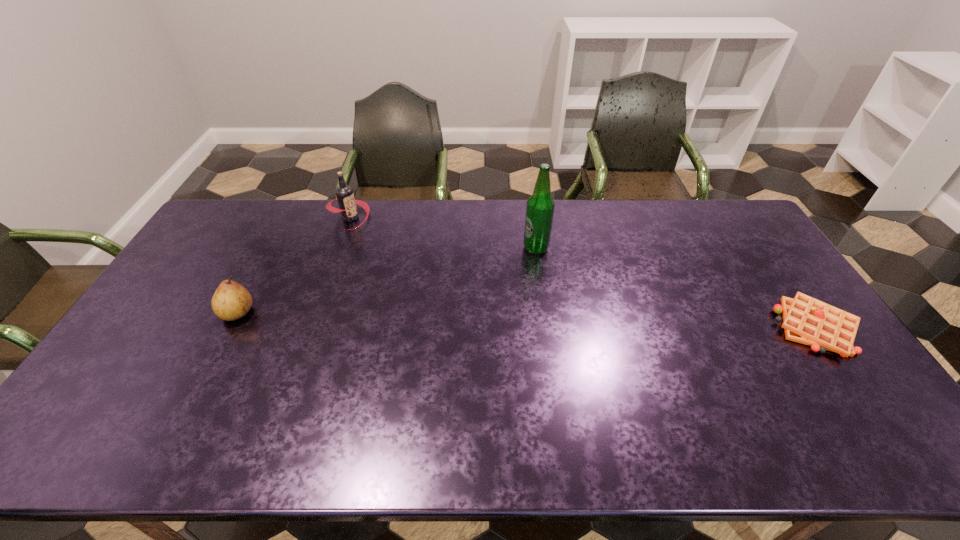
You are a GUI agent. You are given a task and a screenshot of the screen. Output one action in this format:
    pyautogui.click(x=<x>, y=<y>)
    Task: Click on the free space between the third object from right to left and the second object from right to left
    This screenshot has width=960, height=540.
    Given the screenshot: What is the action you would take?
    pyautogui.click(x=443, y=233)

Identify the location of vacant space that is in between the rightmost object and the beer bottle. (676, 288).

Image resolution: width=960 pixels, height=540 pixels. I want to click on free point between the beer bottle and the second tallest object, so click(443, 233).

Identify which object is located as the second nearest to the pear. Please provide its 2D coordinates. Your answer should be formatted as a tuple, i.e. [(x, y)], where the tuple contains the x and y coordinates of a point satisfying the conditions above.

[(540, 206)]

I want to click on object that is the closest to the pear, so click(x=344, y=193).

This screenshot has height=540, width=960. I want to click on free region that satisfies the following two spatial constraints: 1. on the back side of the pear; 2. on the left side of the beer bottle, so click(x=272, y=248).

At what (x,y) coordinates should I click in order to perform the action: click on free space that satisfies the following two spatial constraints: 1. on the front side of the pear; 2. on the right side of the rightmost object. Please return your answer as a coordinate pair (x, y). Looking at the image, I should click on (229, 328).